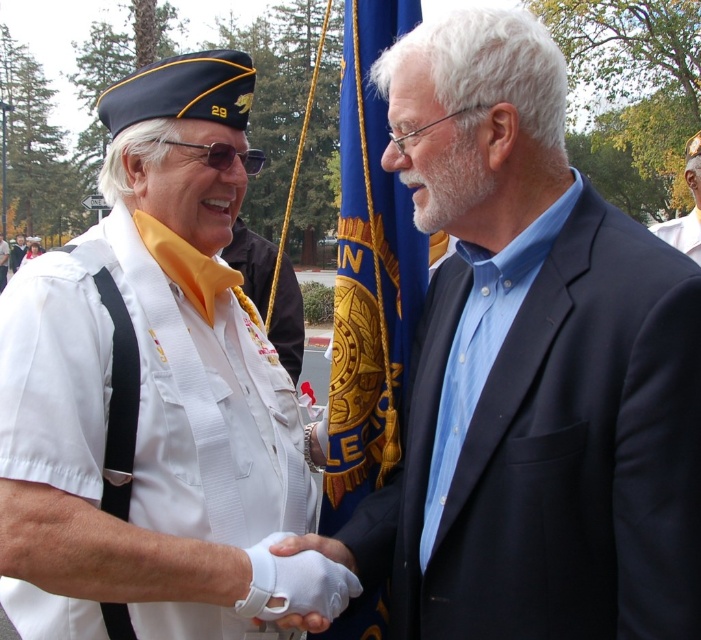
Can you confirm if blue fabric flag at center is taller than white matte uniform at upper right?

No.

Which is above, blue fabric flag at center or white matte uniform at upper right?

white matte uniform at upper right is above.

Is point (341, 49) positioned after point (673, 241)?

No, it is not.

At what (x,y) coordinates should I click in order to perform the action: click on blue fabric flag at center. Please return your answer as a coordinate pair (x, y). Image resolution: width=701 pixels, height=640 pixels. Looking at the image, I should click on (369, 275).

Does white fabric uniform at left appear over white matte uniform at upper right?

No, white fabric uniform at left is not above white matte uniform at upper right.

Who is lower down, white fabric uniform at left or white matte uniform at upper right?

white fabric uniform at left is lower down.

I want to click on white fabric uniform at left, so click(x=205, y=410).

Can you confirm if blue cotton shirt at center is bigger than white matte uniform at upper right?

Incorrect, blue cotton shirt at center is not larger than white matte uniform at upper right.

What do you see at coordinates (529, 369) in the screenshot? The width and height of the screenshot is (701, 640). I see `blue cotton shirt at center` at bounding box center [529, 369].

Find the location of `blue cotton shirt at center`. blue cotton shirt at center is located at coordinates (529, 369).